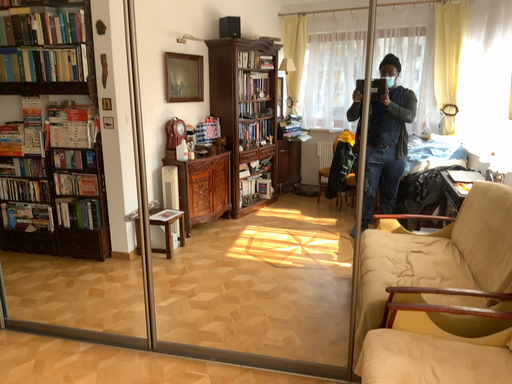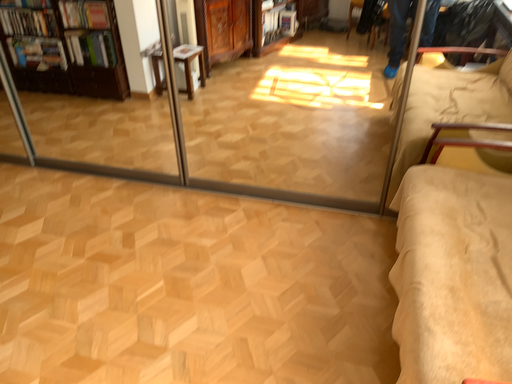
Question: How did the camera likely rotate when shooting the video?

Choices:
 (A) rotated upward
 (B) rotated downward

Answer: (B)